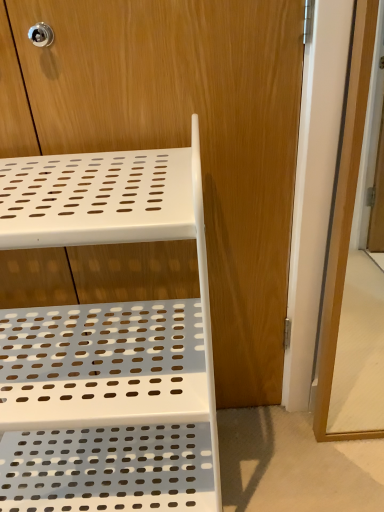
Question: Considering the relative sizes of transparent glass screen door at right and white plastic shelf at upper left in the image provided, is transparent glass screen door at right wider than white plastic shelf at upper left?

Choices:
 (A) no
 (B) yes

Answer: (A)

Question: From a real-world perspective, is transparent glass screen door at right located higher than white plastic shelf at upper left?

Choices:
 (A) yes
 (B) no

Answer: (A)

Question: Is transparent glass screen door at right to the left of white plastic shelf at upper left from the viewer's perspective?

Choices:
 (A) no
 (B) yes

Answer: (A)

Question: Is transparent glass screen door at right closer to the viewer compared to white plastic shelf at upper left?

Choices:
 (A) yes
 (B) no

Answer: (B)

Question: Is transparent glass screen door at right positioned far away from white plastic shelf at upper left?

Choices:
 (A) no
 (B) yes

Answer: (A)

Question: Based on their positions, is transparent glass screen door at right located to the left or right of white plastic shelf at center?

Choices:
 (A) left
 (B) right

Answer: (B)

Question: Relative to white plastic shelf at center, is transparent glass screen door at right in front or behind?

Choices:
 (A) behind
 (B) front

Answer: (B)

Question: Looking at their shapes, would you say transparent glass screen door at right is wider or thinner than white plastic shelf at center?

Choices:
 (A) wide
 (B) thin

Answer: (A)

Question: Is transparent glass screen door at right situated inside white plastic shelf at center or outside?

Choices:
 (A) outside
 (B) inside

Answer: (A)

Question: Is white plastic shelf at center inside or outside of transparent glass screen door at right?

Choices:
 (A) outside
 (B) inside

Answer: (A)

Question: From the image's perspective, is white plastic shelf at center positioned above or below transparent glass screen door at right?

Choices:
 (A) above
 (B) below

Answer: (A)

Question: Based on their sizes in the image, would you say white plastic shelf at center is bigger or smaller than transparent glass screen door at right?

Choices:
 (A) small
 (B) big

Answer: (B)

Question: From a real-world perspective, relative to transparent glass screen door at right, is white plastic shelf at center vertically above or below?

Choices:
 (A) above
 (B) below

Answer: (A)

Question: Is white plastic shelf at upper left in front of or behind transparent glass screen door at right in the image?

Choices:
 (A) behind
 (B) front

Answer: (B)

Question: Looking at the image, does white plastic shelf at upper left seem bigger or smaller compared to transparent glass screen door at right?

Choices:
 (A) small
 (B) big

Answer: (B)